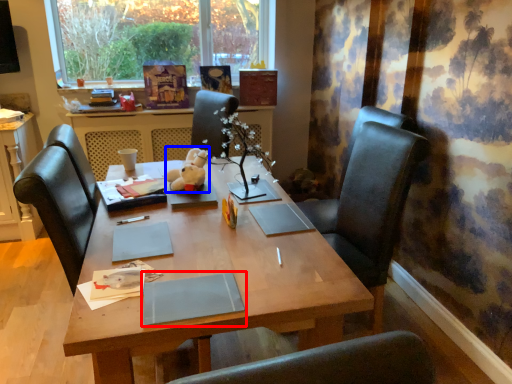
Question: Which object appears closest to the camera in this image, notebook (highlighted by a red box) or toy (highlighted by a blue box)?

Choices:
 (A) notebook
 (B) toy

Answer: (A)